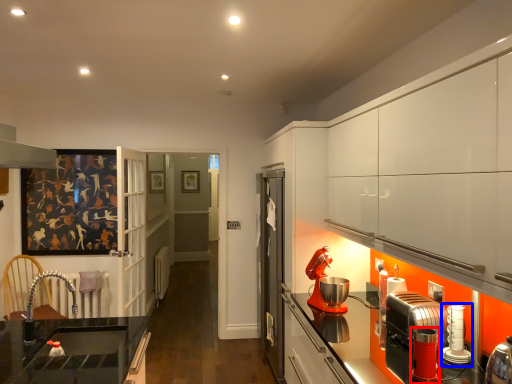
Question: Which of the following is the farthest to the observer, kitchen appliance (highlighted by a red box) or kitchen appliance (highlighted by a blue box)?

Choices:
 (A) kitchen appliance
 (B) kitchen appliance

Answer: (B)